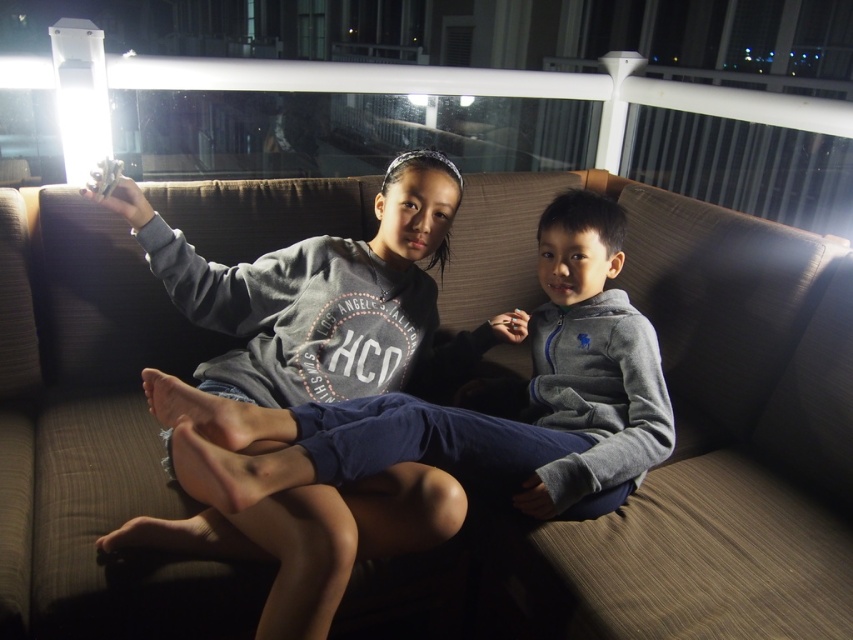
Question: Can you confirm if brown fabric couch at center is thinner than gray fleece sweatshirt at center?

Choices:
 (A) no
 (B) yes

Answer: (A)

Question: Among these objects, which one is nearest to the camera?

Choices:
 (A) brown fabric couch at center
 (B) gray fleece sweatshirt at center

Answer: (B)

Question: From the image, what is the correct spatial relationship of brown fabric couch at center in relation to gray fleece sweatshirt at center?

Choices:
 (A) above
 (B) below

Answer: (A)

Question: Is the position of brown fabric couch at center less distant than that of gray fleece sweatshirt at center?

Choices:
 (A) yes
 (B) no

Answer: (B)